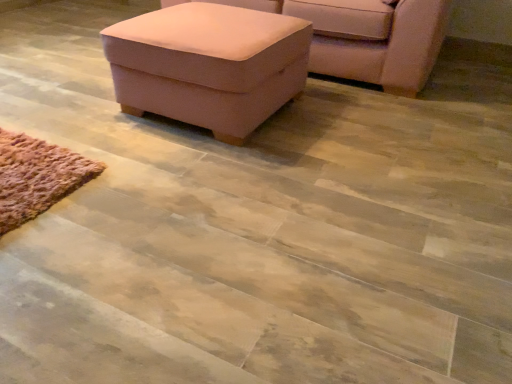
Question: Is suede-like pink ottoman at upper center thinner than pink fabric ottoman at upper center?

Choices:
 (A) yes
 (B) no

Answer: (B)

Question: From the image's perspective, is suede-like pink ottoman at upper center under pink fabric ottoman at upper center?

Choices:
 (A) no
 (B) yes

Answer: (A)

Question: Can you see suede-like pink ottoman at upper center touching pink fabric ottoman at upper center?

Choices:
 (A) yes
 (B) no

Answer: (B)

Question: Is pink fabric ottoman at upper center completely or partially inside suede-like pink ottoman at upper center?

Choices:
 (A) no
 (B) yes

Answer: (A)

Question: Can you confirm if suede-like pink ottoman at upper center is bigger than pink fabric ottoman at upper center?

Choices:
 (A) yes
 (B) no

Answer: (A)

Question: Considering the relative positions of suede-like pink ottoman at upper center and pink fabric ottoman at upper center in the image provided, is suede-like pink ottoman at upper center to the right of pink fabric ottoman at upper center from the viewer's perspective?

Choices:
 (A) no
 (B) yes

Answer: (B)

Question: Is pink fabric ottoman at upper center shorter than suede-like pink ottoman at upper center?

Choices:
 (A) no
 (B) yes

Answer: (B)

Question: Is suede-like pink ottoman at upper center at the back of pink fabric ottoman at upper center?

Choices:
 (A) yes
 (B) no

Answer: (A)

Question: Are pink fabric ottoman at upper center and suede-like pink ottoman at upper center making contact?

Choices:
 (A) yes
 (B) no

Answer: (B)

Question: From a real-world perspective, is pink fabric ottoman at upper center beneath suede-like pink ottoman at upper center?

Choices:
 (A) yes
 (B) no

Answer: (A)

Question: Is pink fabric ottoman at upper center closer to the viewer compared to suede-like pink ottoman at upper center?

Choices:
 (A) no
 (B) yes

Answer: (B)

Question: Considering the relative positions of pink fabric ottoman at upper center and suede-like pink ottoman at upper center in the image provided, is pink fabric ottoman at upper center to the left of suede-like pink ottoman at upper center from the viewer's perspective?

Choices:
 (A) yes
 (B) no

Answer: (A)

Question: From the image's perspective, is suede-like pink ottoman at upper center positioned above or below pink fabric ottoman at upper center?

Choices:
 (A) below
 (B) above

Answer: (B)